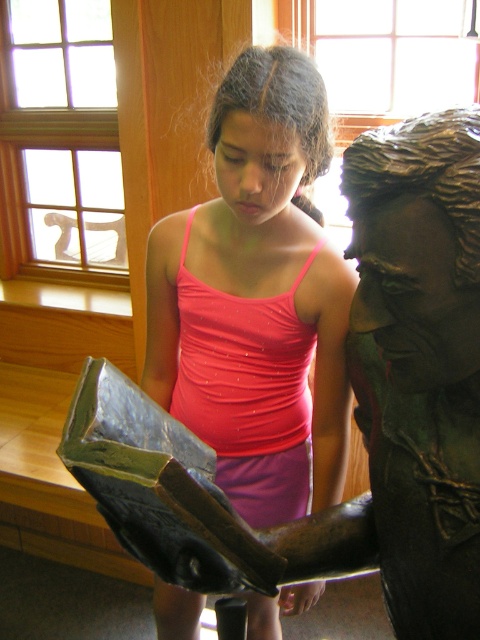
Is bronze statue at center closer to camera compared to pink matte tank top at center?

Yes, bronze statue at center is in front of pink matte tank top at center.

From the picture: Who is positioned more to the left, bronze statue at center or pink matte tank top at center?

From the viewer's perspective, pink matte tank top at center appears more on the left side.

Between point (392, 524) and point (250, 477), which one is positioned in front?

Point (392, 524) is in front.

Where is `bronze statue at center`? This screenshot has width=480, height=640. bronze statue at center is located at coordinates (381, 401).